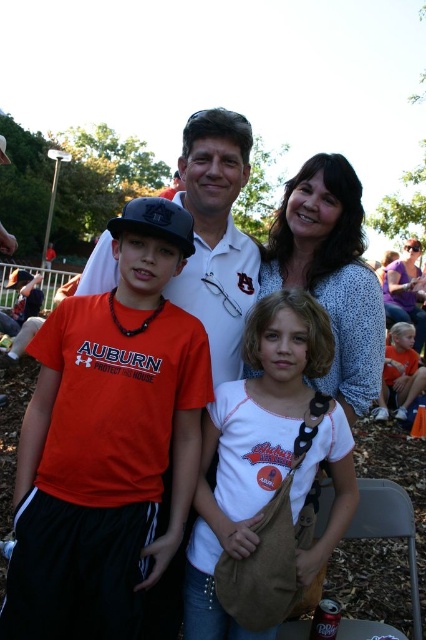
Question: Which point is closer to the camera taking this photo?

Choices:
 (A) (322, 184)
 (B) (150, 492)

Answer: (B)

Question: In this image, where is white dotted blouse at center located relative to white matte shirt at center?

Choices:
 (A) left
 (B) right

Answer: (B)

Question: Can you confirm if white matte shirt at center is bigger than matte purple shirt at upper right?

Choices:
 (A) no
 (B) yes

Answer: (A)

Question: Which of the following is the closest to the observer?

Choices:
 (A) orange t-shirt at lower left
 (B) white matte shirt at center
 (C) orange cotton shirt at center
 (D) matte purple shirt at upper right

Answer: (C)

Question: Considering the real-world distances, which object is closest to the orange t-shirt at lower left?

Choices:
 (A) orange cotton shirt at center
 (B) white matte shirt at center
 (C) white cotton shirt at center

Answer: (B)

Question: Is white dotted blouse at center smaller than matte purple shirt at upper right?

Choices:
 (A) no
 (B) yes

Answer: (B)